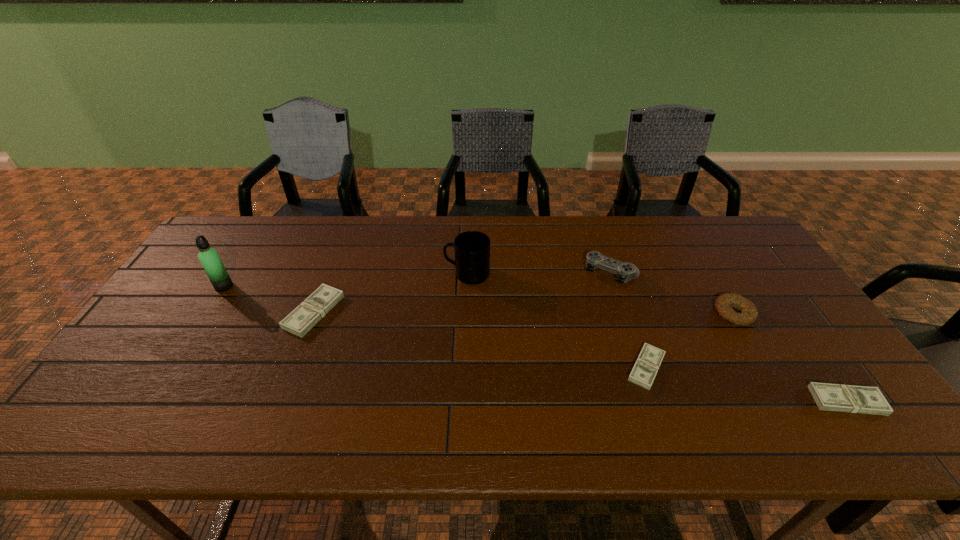
The image size is (960, 540). I want to click on the farthest money, so click(304, 317).

Locate an element on the screen. The width and height of the screenshot is (960, 540). the second object from left to right is located at coordinates (304, 317).

At what (x,y) coordinates should I click in order to perform the action: click on the shortest object. Please return your answer as a coordinate pair (x, y). Looking at the image, I should click on (648, 362).

Where is `the second money from right to left`? The image size is (960, 540). the second money from right to left is located at coordinates (648, 362).

In order to click on the rightmost money in this screenshot , I will do `click(831, 397)`.

Where is `the second shortest object`? The height and width of the screenshot is (540, 960). the second shortest object is located at coordinates (831, 397).

This screenshot has width=960, height=540. Identify the location of the sixth shortest object. (472, 248).

The image size is (960, 540). What are the coordinates of `the fifth object from right to left` in the screenshot? It's located at (472, 248).

At what (x,y) coordinates should I click in order to perform the action: click on bagel. Please return your answer as a coordinate pair (x, y). The width and height of the screenshot is (960, 540). Looking at the image, I should click on (749, 313).

You are a GUI agent. You are given a task and a screenshot of the screen. Output one action in this format:
    pyautogui.click(x=<x>, y=<y>)
    Task: Click on the second object from right to left
    
    Given the screenshot: What is the action you would take?
    pyautogui.click(x=749, y=313)